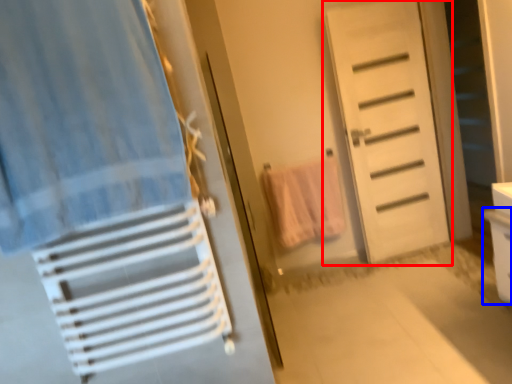
Question: Which point is closer to the camera, door (highlighted by a red box) or drawer (highlighted by a blue box)?

Choices:
 (A) door
 (B) drawer

Answer: (B)